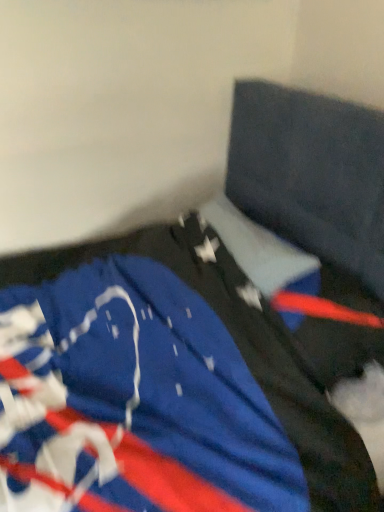
What do you see at coordinates (133, 401) in the screenshot? I see `blue fabric flag at center` at bounding box center [133, 401].

The image size is (384, 512). I want to click on blue fabric flag at center, so [x=133, y=401].

Identify the location of blue fabric flag at center. (133, 401).